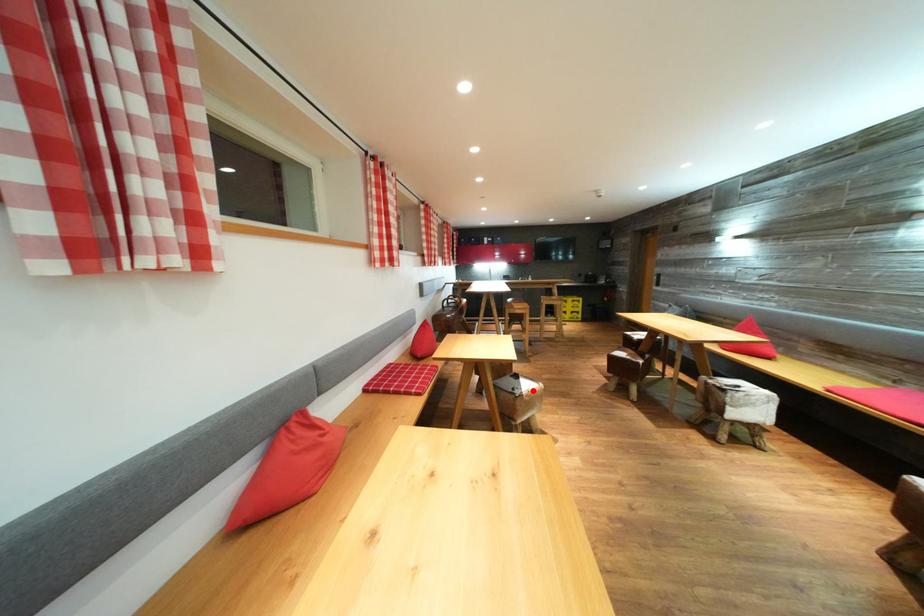
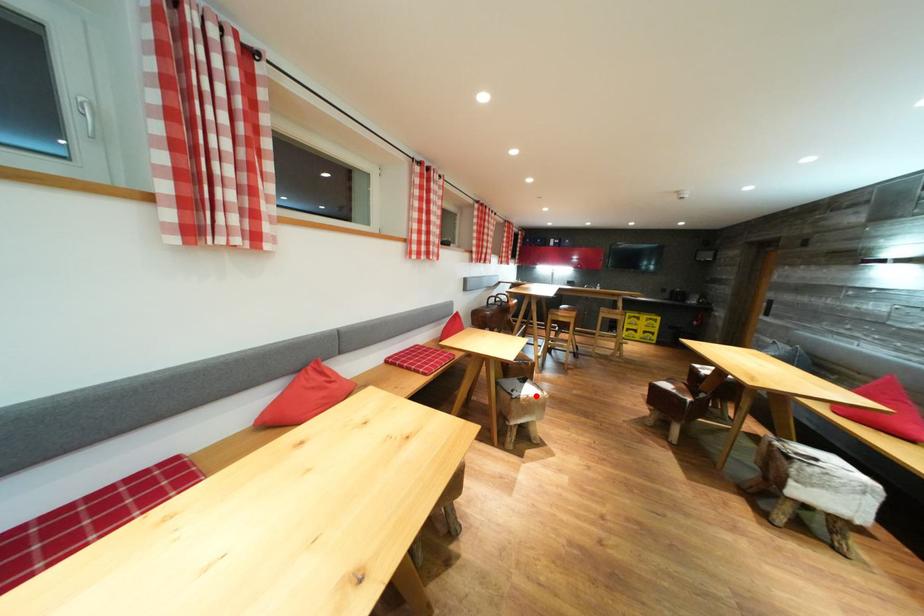
I am providing you with two images of the same scene from different viewpoints. A red point is marked on the first image and another point is marked on the second image. Is the red point in image1 aligned with the point shown in image2?

Yes